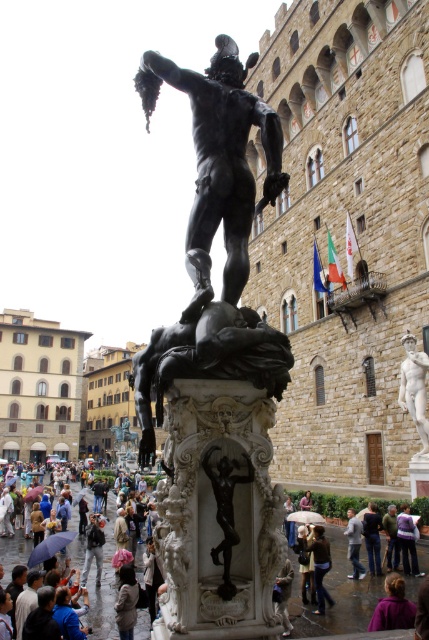
Which of these two, raincoats umbrellas at lower center or light blue jeans at center, stands taller?

With more height is raincoats umbrellas at lower center.

Measure the distance between point [105,620] and camera.

27.63 meters

Where is `raincoats umbrellas at lower center`? raincoats umbrellas at lower center is located at coordinates (103, 586).

Between bronze statue at center and light blue jeans at center, which one has more height?

bronze statue at center is taller.

Who is shorter, bronze statue at center or light blue jeans at center?

light blue jeans at center is shorter.

Is point (217, 92) positioned before point (350, 531)?

Yes, point (217, 92) is closer to viewer.

Where is `bronze statue at center`? The height and width of the screenshot is (640, 429). bronze statue at center is located at coordinates (x=218, y=161).

Can you confirm if bronze statue at center is taller than raincoats umbrellas at lower center?

Yes, bronze statue at center is taller than raincoats umbrellas at lower center.

Consider the image. Who is more forward, (244, 195) or (23, 557)?

Positioned in front is point (244, 195).

What do you see at coordinates (218, 161) in the screenshot? I see `bronze statue at center` at bounding box center [218, 161].

You are a GUI agent. You are given a task and a screenshot of the screen. Output one action in this format:
    pyautogui.click(x=<x>, y=<y>)
    Task: Click on the bronze statue at center
    This screenshot has height=640, width=429.
    Given the screenshot: What is the action you would take?
    pyautogui.click(x=218, y=161)